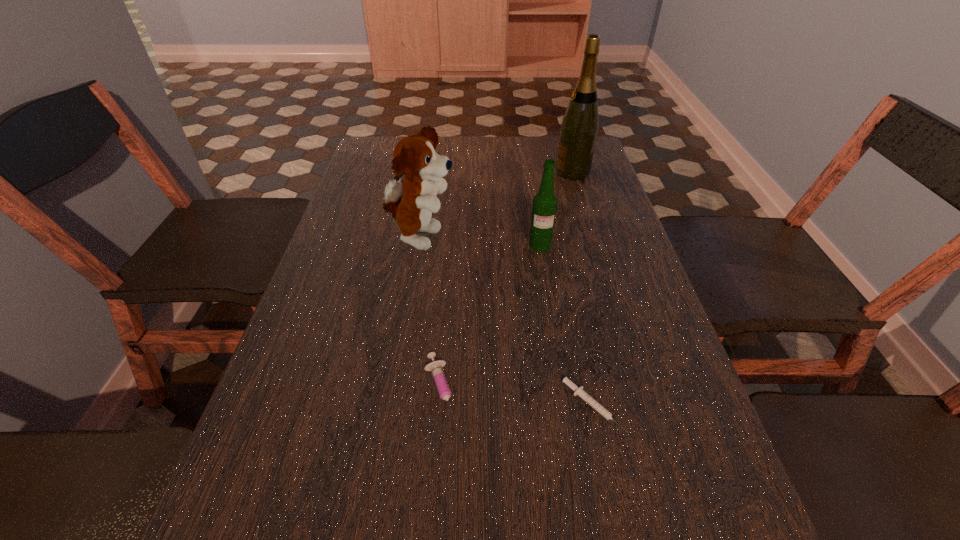
Find the location of a particular element. Image resolution: width=960 pixels, height=540 pixels. the tallest object is located at coordinates (579, 128).

Locate an element on the screen. wine bottle is located at coordinates (579, 128).

Find the location of `the second tallest object`. the second tallest object is located at coordinates (412, 200).

What are the coordinates of `beer bottle` in the screenshot? It's located at (544, 208).

Locate an element on the screen. the second shortest object is located at coordinates pyautogui.click(x=441, y=383).

Where is `the taller syringe`? The image size is (960, 540). the taller syringe is located at coordinates (441, 383).

Locate an element on the screen. Image resolution: width=960 pixels, height=540 pixels. the shorter syringe is located at coordinates (579, 391).

The image size is (960, 540). I want to click on the shortest object, so click(x=579, y=391).

Find the location of a particular element. This screenshot has height=540, width=960. free space located on the front-facing side of the tallest object is located at coordinates (540, 172).

Where is `vacant space situated on the front-facing side of the tallest object`? The height and width of the screenshot is (540, 960). vacant space situated on the front-facing side of the tallest object is located at coordinates (516, 172).